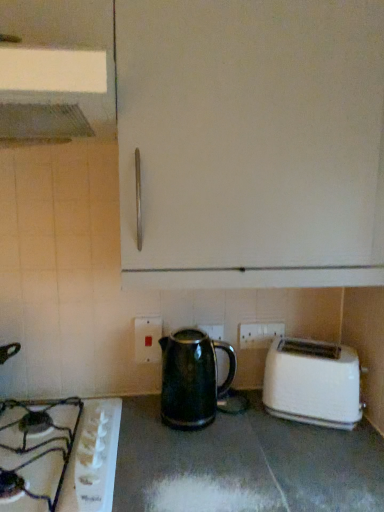
Question: Is green glossy kettle at center far from white plastic electric outlet at lower center, which is the second electric outlet from back to front?

Choices:
 (A) yes
 (B) no

Answer: (B)

Question: Can you confirm if green glossy kettle at center is positioned to the left of white plastic electric outlet at lower center, which is the second electric outlet from back to front?

Choices:
 (A) yes
 (B) no

Answer: (B)

Question: Does green glossy kettle at center have a greater width compared to white plastic electric outlet at lower center, placed as the 1th electric outlet when sorted from front to back?

Choices:
 (A) no
 (B) yes

Answer: (B)

Question: Is white plastic electric outlet at lower center, which is the second electric outlet from back to front, located within green glossy kettle at center?

Choices:
 (A) no
 (B) yes

Answer: (A)

Question: Considering the relative sizes of green glossy kettle at center and white plastic electric outlet at lower center, placed as the 1th electric outlet when sorted from front to back, in the image provided, is green glossy kettle at center shorter than white plastic electric outlet at lower center, placed as the 1th electric outlet when sorted from front to back,?

Choices:
 (A) no
 (B) yes

Answer: (A)

Question: In the image, is black glossy kettle at center positioned in front of or behind metallic silver exhaust hood at upper left?

Choices:
 (A) behind
 (B) front

Answer: (A)

Question: Choose the correct answer: Is black glossy kettle at center inside metallic silver exhaust hood at upper left or outside it?

Choices:
 (A) inside
 (B) outside

Answer: (B)

Question: Is point (235, 468) closer or farther from the camera than point (61, 53)?

Choices:
 (A) closer
 (B) farther

Answer: (B)

Question: From the image's perspective, relative to metallic silver exhaust hood at upper left, is black glossy kettle at center above or below?

Choices:
 (A) below
 (B) above

Answer: (A)

Question: Considering their positions, is white plastic electrical outlet at center, which is the second electric outlet from front to back, located in front of or behind metallic silver exhaust hood at upper left?

Choices:
 (A) front
 (B) behind

Answer: (B)

Question: In terms of size, does white plastic electrical outlet at center, arranged as the 1th electric outlet when viewed from the right, appear bigger or smaller than metallic silver exhaust hood at upper left?

Choices:
 (A) small
 (B) big

Answer: (A)

Question: From the image's perspective, is white plastic electrical outlet at center, acting as the first electric outlet starting from the back, positioned above or below metallic silver exhaust hood at upper left?

Choices:
 (A) above
 (B) below

Answer: (B)

Question: Considering the positions of white plastic electrical outlet at center, which ranks as the second electric outlet in left-to-right order, and metallic silver exhaust hood at upper left in the image, is white plastic electrical outlet at center, which ranks as the second electric outlet in left-to-right order, taller or shorter than metallic silver exhaust hood at upper left?

Choices:
 (A) tall
 (B) short

Answer: (B)

Question: In the image, is green glossy kettle at center on the left side or the right side of black glossy kettle at center?

Choices:
 (A) right
 (B) left

Answer: (A)

Question: Considering the positions of green glossy kettle at center and black glossy kettle at center in the image, is green glossy kettle at center bigger or smaller than black glossy kettle at center?

Choices:
 (A) big
 (B) small

Answer: (B)